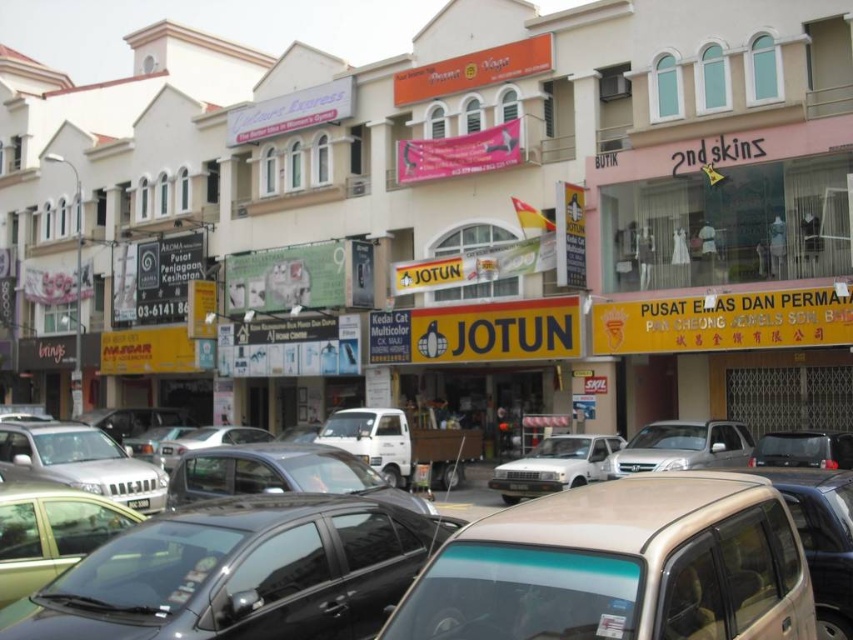
You are a delivery person who needs to park your motorcycle between the white matte car at center and the black plastic license plate at center. Can you fit your motorcycle, which is 1.2 meters wide, in the space between them?

The white matte car at center might be wider than the black plastic license plate at center, so the space between them may not be wide enough for your motorcycle which is 1.2 meters wide. You should check the actual width before deciding to park there.

You are a delivery person who needs to park your vehicle between the metallic silver car at center and the satin beige car at center. However, you notice something about their positions. What is the issue preventing you from parking there?

The metallic silver car at center is located above the satin beige car at center, meaning there is no space between them horizontally for the delivery vehicle to park.

You are a delivery driver who needs to park your vehicle at the designated spot marked at coordinates point 0.728, 0.652. There is a white matte car at center currently occupying that spot. Can you park your vehicle there?

The white matte car at center is already occupying the designated parking spot at coordinates point (555, 465), so you cannot park there until it leaves.